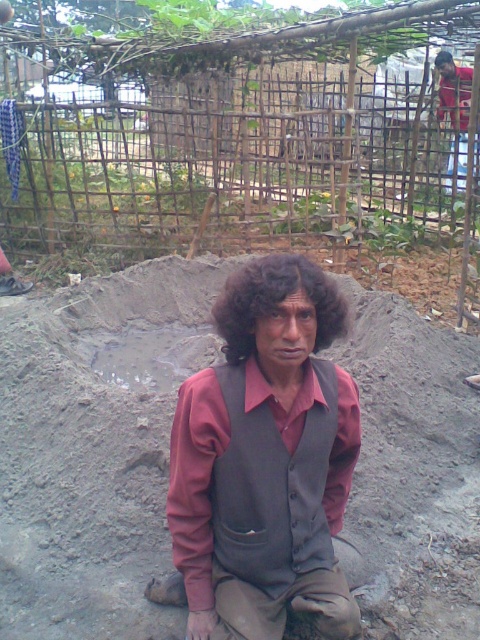
Is point (333, 436) more distant than point (248, 301)?

That is True.

Who is more forward, (x=264, y=422) or (x=252, y=316)?

Point (x=252, y=316)

I want to click on dark gray fabric vest at center, so click(x=264, y=442).

Is dark curly hair at center wider than brown fabric shirt at upper right?

No, dark curly hair at center is not wider than brown fabric shirt at upper right.

Measure the distance between point (334, 320) and camera.

6.87 feet

What are the coordinates of `dark curly hair at center` in the screenshot? It's located at (276, 301).

Which of these two, gray clay pit at center or dark gray fabric vest at center, stands taller?

gray clay pit at center is taller.

Can you confirm if gray clay pit at center is shorter than dark gray fabric vest at center?

Incorrect, gray clay pit at center's height does not fall short of dark gray fabric vest at center's.

Which is in front, point (84, 355) or point (249, 561)?

Point (249, 561)

Image resolution: width=480 pixels, height=640 pixels. Find the location of `gray clay pit at center`. gray clay pit at center is located at coordinates (95, 445).